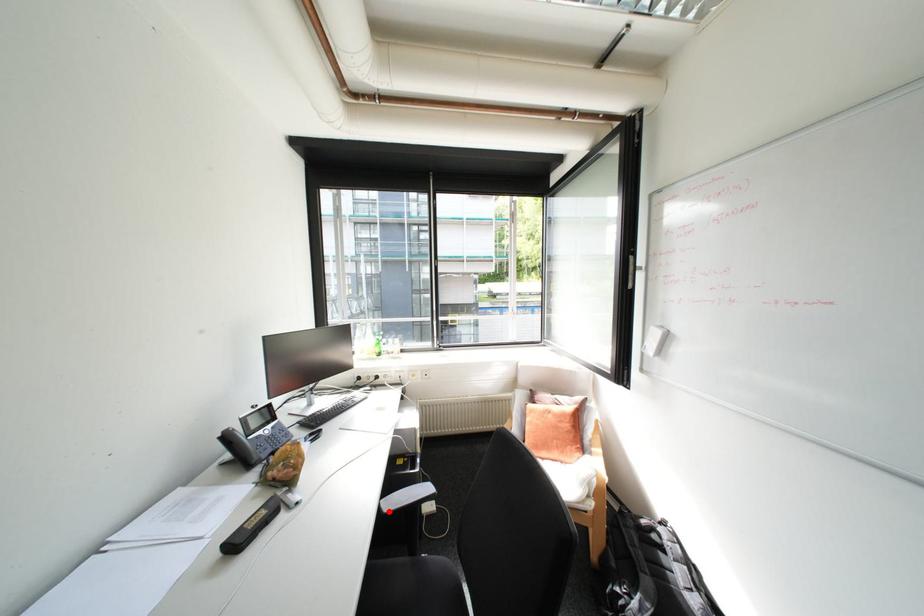
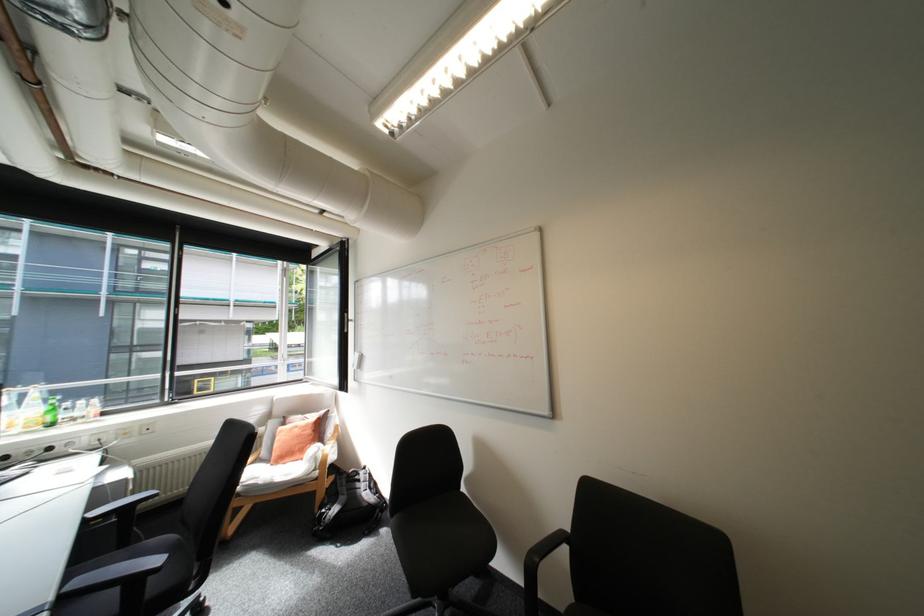
The point at the highlighted location is marked in the first image. Where is the corresponding point in the second image?

(94, 519)